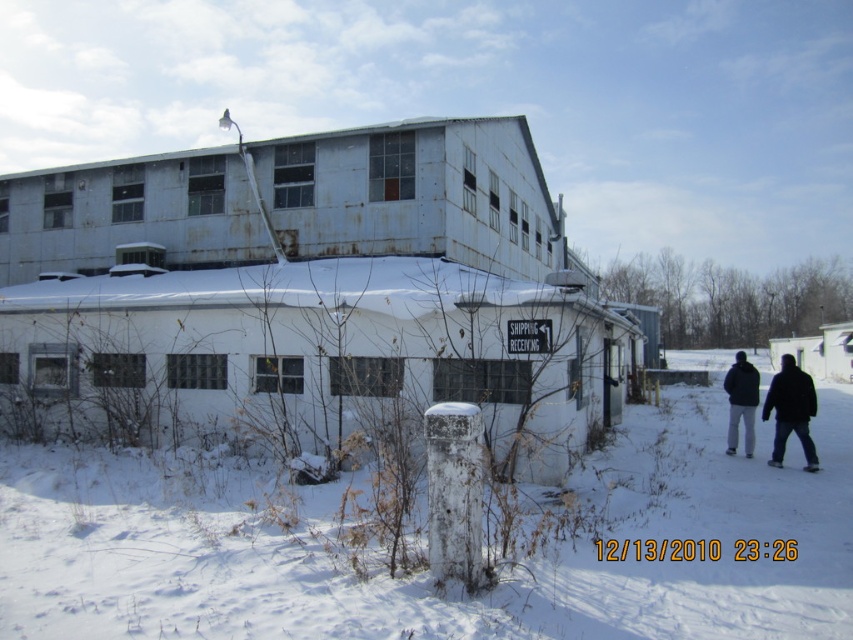
Question: Does white powdery snow at center come behind dark gray jacket at lower right?

Choices:
 (A) yes
 (B) no

Answer: (B)

Question: Which of the following is the farthest from the observer?

Choices:
 (A) (753, 440)
 (B) (107, 513)

Answer: (A)

Question: Is dark gray jacket at lower right in front of black matte jacket at lower right?

Choices:
 (A) no
 (B) yes

Answer: (B)

Question: Among these points, which one is nearest to the camera?

Choices:
 (A) (782, 448)
 (B) (746, 369)

Answer: (A)

Question: Which point appears closest to the camera in this image?

Choices:
 (A) (730, 426)
 (B) (792, 426)

Answer: (B)

Question: Does dark gray jacket at lower right have a larger size compared to black matte jacket at lower right?

Choices:
 (A) yes
 (B) no

Answer: (A)